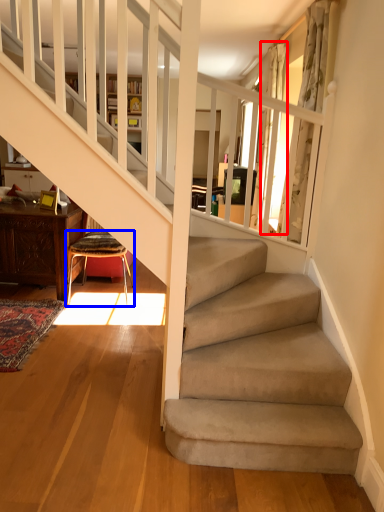
Question: Which of the following is the farthest to the observer, curtain (highlighted by a red box) or chair (highlighted by a blue box)?

Choices:
 (A) curtain
 (B) chair

Answer: (A)